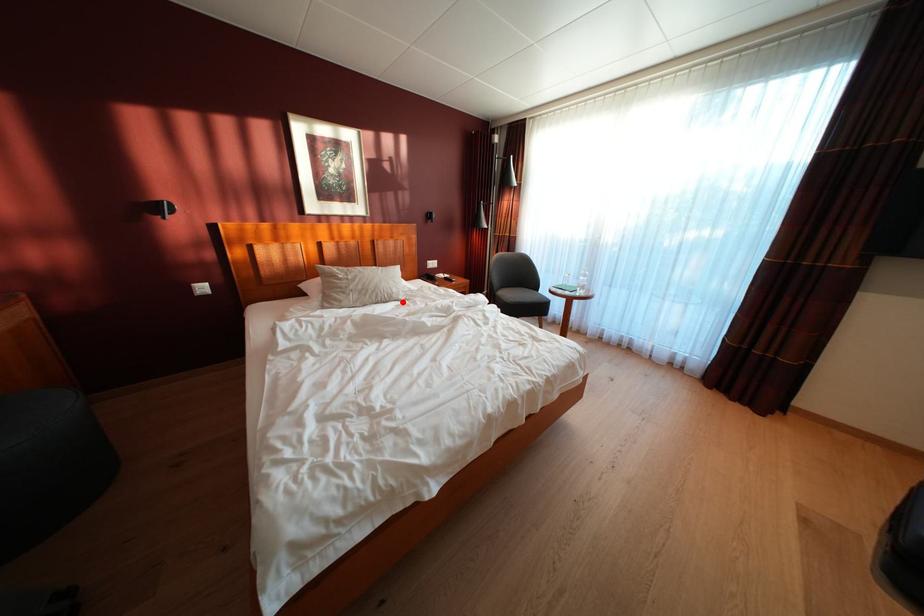
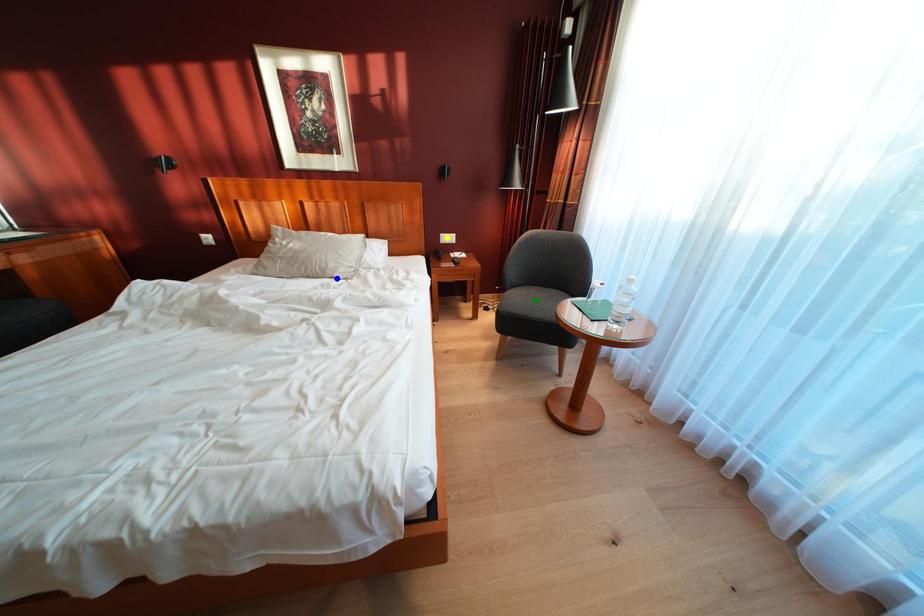
Question: I am providing you with two images of the same scene from different viewpoints. A red point is marked on the first image. You are given multiple points on the second image. Can you choose the point in image 2 that corresponds to the point in image 1?

Choices:
 (A) green point
 (B) blue point
 (C) yellow point

Answer: (B)